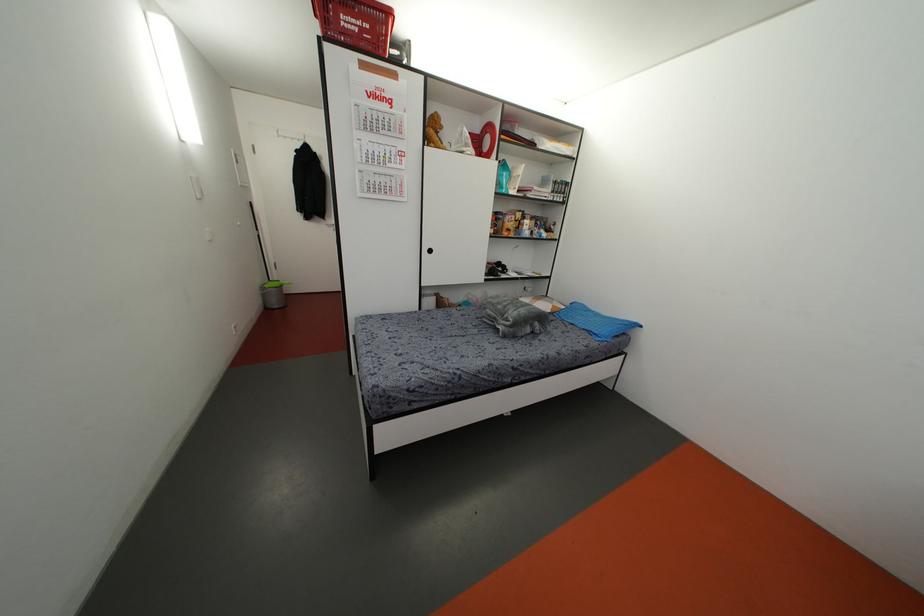
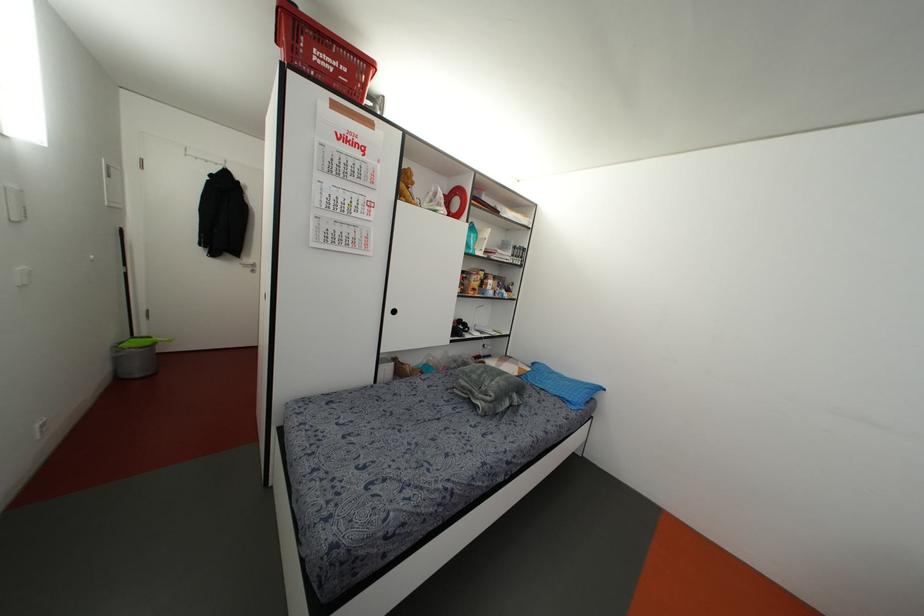
Locate, in the second image, the point that corresponds to point (237, 159) in the first image.

(112, 172)